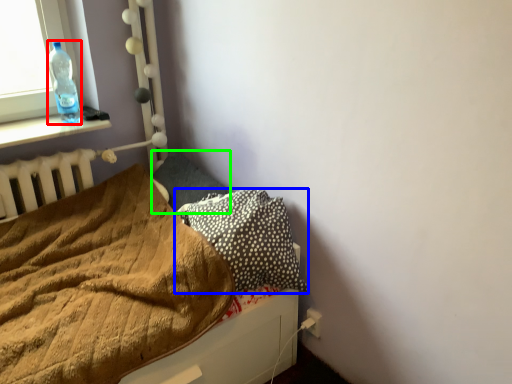
Question: Considering the real-world distances, which object is farthest from bottle (highlighted by a red box)? pillow (highlighted by a blue box) or pillow (highlighted by a green box)?

Choices:
 (A) pillow
 (B) pillow

Answer: (A)